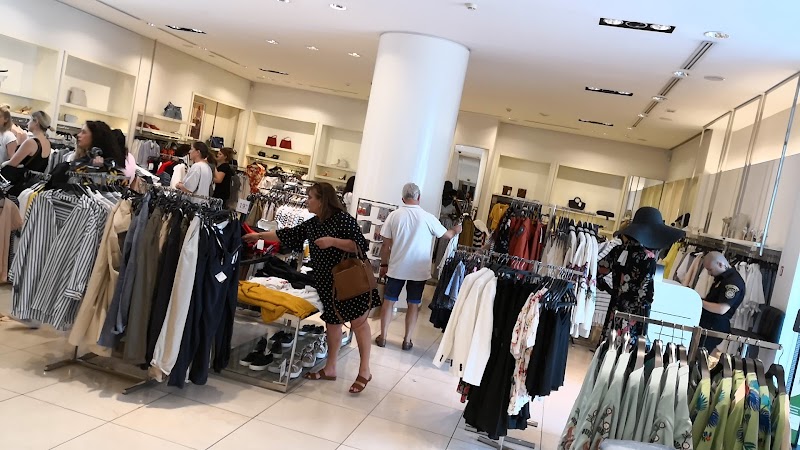
The image size is (800, 450). I want to click on shelves, so click(x=21, y=98), click(x=22, y=116), click(x=110, y=113), click(x=74, y=127), click(x=286, y=150), click(x=294, y=163), click(x=340, y=167), click(x=340, y=180), click(x=514, y=199), click(x=594, y=218).